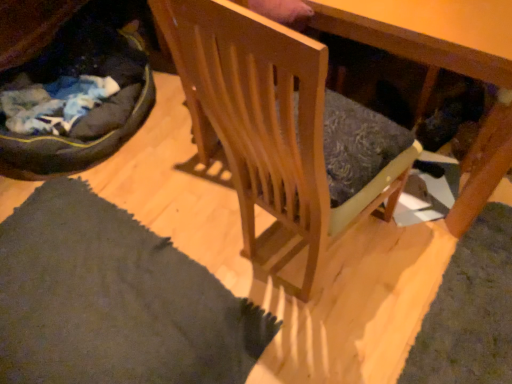
The image size is (512, 384). What do you see at coordinates (268, 125) in the screenshot?
I see `wooden chair at center` at bounding box center [268, 125].

Based on the photo, what is the approximate height of wooden chair at center?

It is 1.07 meters.

You are a GUI agent. You are given a task and a screenshot of the screen. Output one action in this format:
    pyautogui.click(x=<x>, y=<y>)
    Task: Click on the wooden chair at center
    The height and width of the screenshot is (384, 512).
    Given the screenshot: What is the action you would take?
    pyautogui.click(x=268, y=125)

What do you see at coordinates (92, 110) in the screenshot? I see `dark gray fabric cat bed at lower left` at bounding box center [92, 110].

Find the location of a particular element. Image resolution: width=512 pixels, height=384 pixels. dark gray fabric cat bed at lower left is located at coordinates (92, 110).

At what (x,y) coordinates should I click in order to perform the action: click on wooden chair at center. Please return your answer as a coordinate pair (x, y). Looking at the image, I should click on (268, 125).

Considering the positions of objects wooden chair at center and dark gray fabric cat bed at lower left in the image provided, who is more to the left, wooden chair at center or dark gray fabric cat bed at lower left?

Positioned to the left is dark gray fabric cat bed at lower left.

In the image, is wooden chair at center positioned in front of or behind dark gray fabric cat bed at lower left?

wooden chair at center is positioned closer to the viewer than dark gray fabric cat bed at lower left.

Considering the points (283, 85) and (148, 70), which point is in front, point (283, 85) or point (148, 70)?

Positioned in front is point (283, 85).

From the image's perspective, which one is positioned lower, wooden chair at center or dark gray fabric cat bed at lower left?

wooden chair at center, from the image's perspective.

From a real-world perspective, is wooden chair at center located higher than dark gray fabric cat bed at lower left?

Correct, in the physical world, wooden chair at center is higher than dark gray fabric cat bed at lower left.

Does wooden chair at center have a lesser width compared to dark gray fabric cat bed at lower left?

Yes.

From their relative heights in the image, would you say wooden chair at center is taller or shorter than dark gray fabric cat bed at lower left?

Clearly, wooden chair at center is taller compared to dark gray fabric cat bed at lower left.

Is wooden chair at center bigger than dark gray fabric cat bed at lower left?

Actually, wooden chair at center might be smaller than dark gray fabric cat bed at lower left.

Is wooden chair at center situated inside dark gray fabric cat bed at lower left or outside?

The correct answer is: outside.

Would you say wooden chair at center is a long distance from dark gray fabric cat bed at lower left?

No.

Is wooden chair at center positioned with its back to dark gray fabric cat bed at lower left?

No, wooden chair at center's orientation is not away from dark gray fabric cat bed at lower left.

What's the angular difference between wooden chair at center and dark gray fabric cat bed at lower left's facing directions?

83.1 degrees separate the facing orientations of wooden chair at center and dark gray fabric cat bed at lower left.

Image resolution: width=512 pixels, height=384 pixels. I want to click on chair on the right of dark gray fabric cat bed at lower left, so click(x=268, y=125).

Which object is positioned more to the right, dark gray fabric cat bed at lower left or wooden chair at center?

wooden chair at center is more to the right.

Is dark gray fabric cat bed at lower left further to the viewer compared to wooden chair at center?

Yes, the depth of dark gray fabric cat bed at lower left is greater than that of wooden chair at center.

Which is behind, point (126, 61) or point (212, 31)?

The point (126, 61) is farther from the camera.

From the image's perspective, which is above, dark gray fabric cat bed at lower left or wooden chair at center?

From the image's view, dark gray fabric cat bed at lower left is above.

From a real-world perspective, who is located lower, dark gray fabric cat bed at lower left or wooden chair at center?

From a 3D spatial view, dark gray fabric cat bed at lower left is below.

Does dark gray fabric cat bed at lower left have a greater width compared to wooden chair at center?

Correct, the width of dark gray fabric cat bed at lower left exceeds that of wooden chair at center.

In the scene shown: Considering the sizes of objects dark gray fabric cat bed at lower left and wooden chair at center in the image provided, who is shorter, dark gray fabric cat bed at lower left or wooden chair at center?

Standing shorter between the two is dark gray fabric cat bed at lower left.

Considering the relative sizes of dark gray fabric cat bed at lower left and wooden chair at center in the image provided, is dark gray fabric cat bed at lower left bigger than wooden chair at center?

Yes.

Is dark gray fabric cat bed at lower left inside or outside of wooden chair at center?

dark gray fabric cat bed at lower left is outside wooden chair at center.

Is dark gray fabric cat bed at lower left beside wooden chair at center?

No, dark gray fabric cat bed at lower left is not making contact with wooden chair at center.

Is dark gray fabric cat bed at lower left oriented towards wooden chair at center?

Yes, dark gray fabric cat bed at lower left is turned towards wooden chair at center.

Can you tell me how much dark gray fabric cat bed at lower left and wooden chair at center differ in facing direction?

The angular difference between dark gray fabric cat bed at lower left and wooden chair at center is 83.1 degrees.

Find the location of `chair that is on the right side of dark gray fabric cat bed at lower left`. chair that is on the right side of dark gray fabric cat bed at lower left is located at coordinates (268, 125).

The height and width of the screenshot is (384, 512). Find the location of `chair on the right of dark gray fabric cat bed at lower left`. chair on the right of dark gray fabric cat bed at lower left is located at coordinates (268, 125).

The width and height of the screenshot is (512, 384). What are the coordinates of `chair above the dark gray fabric cat bed at lower left (from a real-world perspective)` in the screenshot? It's located at (268, 125).